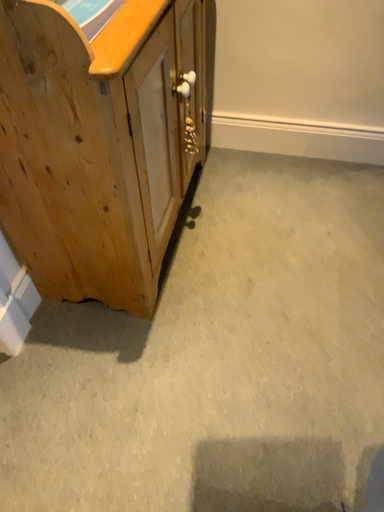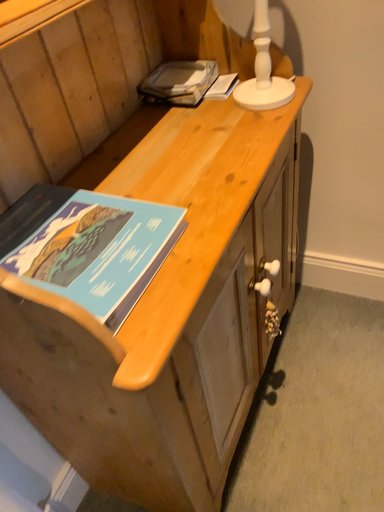
Question: How did the camera likely rotate when shooting the video?

Choices:
 (A) rotated left
 (B) rotated right

Answer: (A)